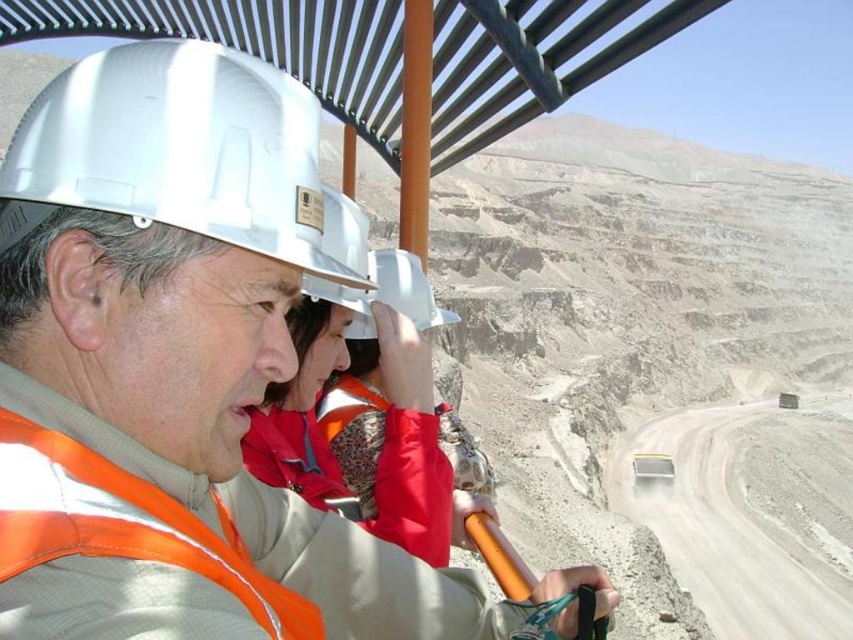
You are standing at the metal canopy structure and want to walk to the point marked as point (85, 179). However, there is an obstacle at point marked as point (279, 273). Which point is closer to you so you can decide the best path?

Point (85, 179) is closer to you than point (279, 273), so you should walk towards point (85, 179) to avoid the obstacle.

You are a safety inspector checking equipment sizes in the mining area. You notice the orange reflective vest at center and the white matte hard hat at upper center. Which object takes up more space in the image?

The orange reflective vest at center is bigger than the white matte hard hat at upper center, so it takes up more space in the image.